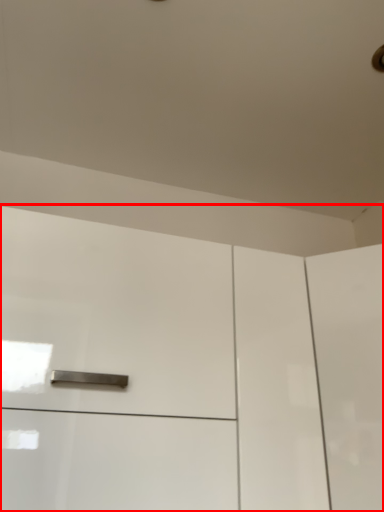
Question: Considering the relative positions of cabinetry (annotated by the red box) and screen door in the image provided, where is cabinetry (annotated by the red box) located with respect to the staircase?

Choices:
 (A) right
 (B) left

Answer: (B)